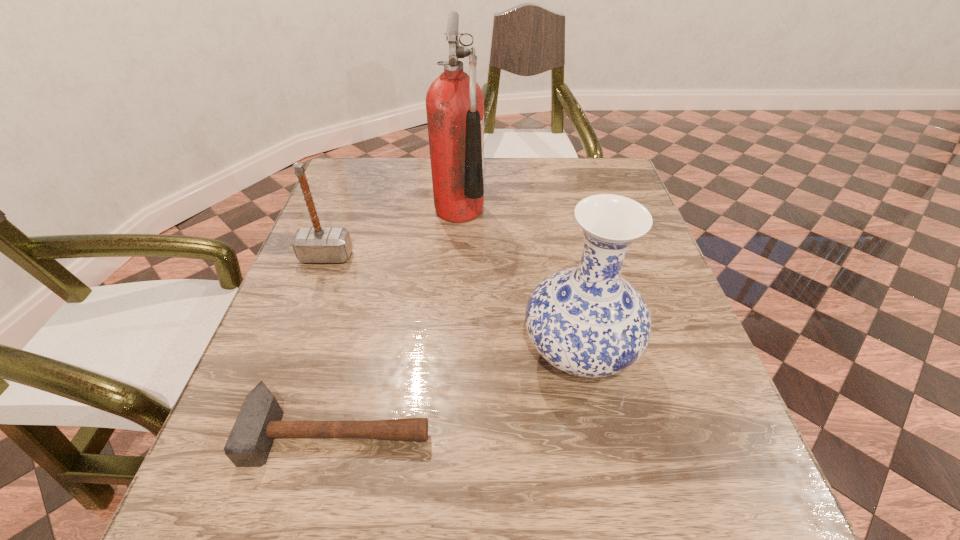
You are a GUI agent. You are given a task and a screenshot of the screen. Output one action in this format:
    pyautogui.click(x=<x>, y=<y>)
    Task: Click on the vacant space that satisfies the following two spatial constraints: 1. on the front of the farthest object near the operation label; 2. on the striking surface of the nearer hammer
    
    Given the screenshot: What is the action you would take?
    pyautogui.click(x=446, y=430)

The width and height of the screenshot is (960, 540). In order to click on vacant area in the image that satisfies the following two spatial constraints: 1. on the front of the tallest object near the operation label; 2. on the back side of the second tallest object in this screenshot , I will do `click(451, 353)`.

Identify the location of free space that satisfies the following two spatial constraints: 1. on the striking surface of the rightmost object; 2. on the right side of the taller hammer. pyautogui.click(x=290, y=353).

Identify the location of vacant region that satisfies the following two spatial constraints: 1. on the striking surface of the third shortest object; 2. on the right side of the taller hammer. (290, 353).

This screenshot has width=960, height=540. I want to click on vacant space that satisfies the following two spatial constraints: 1. on the striking surface of the rightmost object; 2. on the left side of the second farthest object, so click(x=290, y=353).